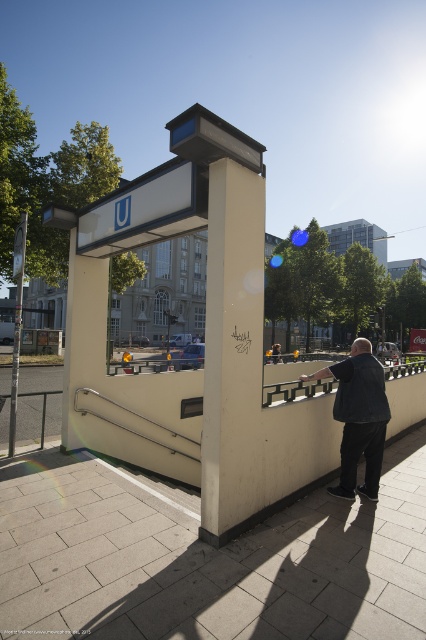
Can you confirm if beige concrete bus stop at center is positioned to the right of dark blue denim jacket at center?

No, beige concrete bus stop at center is not to the right of dark blue denim jacket at center.

Looking at this image, which is more to the right, beige concrete bus stop at center or dark blue denim jacket at center?

dark blue denim jacket at center is more to the right.

Is point (213, 301) less distant than point (339, 412)?

Yes, point (213, 301) is in front of point (339, 412).

What are the coordinates of `beige concrete bus stop at center` in the screenshot? It's located at (206, 336).

Can you confirm if gray concrete pavement at lower center is positioned to the left of beige concrete bus stop at center?

Incorrect, gray concrete pavement at lower center is not on the left side of beige concrete bus stop at center.

Can you confirm if gray concrete pavement at lower center is positioned above beige concrete bus stop at center?

Actually, gray concrete pavement at lower center is below beige concrete bus stop at center.

This screenshot has width=426, height=640. Describe the element at coordinates (207, 557) in the screenshot. I see `gray concrete pavement at lower center` at that location.

You are a GUI agent. You are given a task and a screenshot of the screen. Output one action in this format:
    pyautogui.click(x=<x>, y=<y>)
    Task: Click on the gray concrete pavement at lower center
    Image resolution: width=426 pixels, height=640 pixels.
    Given the screenshot: What is the action you would take?
    pyautogui.click(x=207, y=557)

Who is taller, gray concrete pavement at lower center or dark blue denim jacket at center?

dark blue denim jacket at center

Which is in front, point (242, 566) or point (379, 474)?

Point (242, 566) is more forward.

Find the location of a particular element. The height and width of the screenshot is (640, 426). gray concrete pavement at lower center is located at coordinates (207, 557).